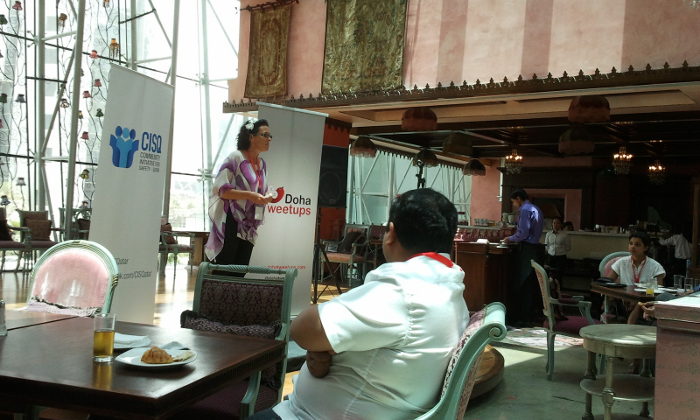
The image size is (700, 420). Find the location of `light fixtures`. light fixtures is located at coordinates (363, 144), (425, 157), (476, 168).